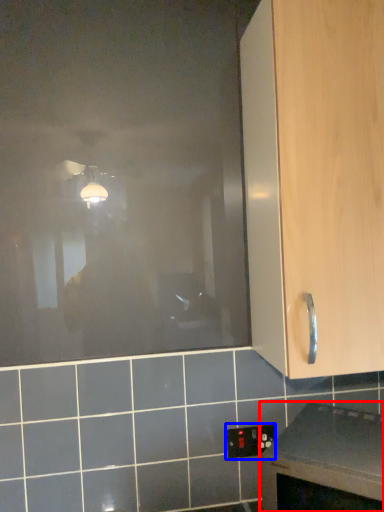
Question: Among these objects, which one is nearest to the camera, countertop (highlighted by a red box) or electric outlet (highlighted by a blue box)?

Choices:
 (A) countertop
 (B) electric outlet

Answer: (A)